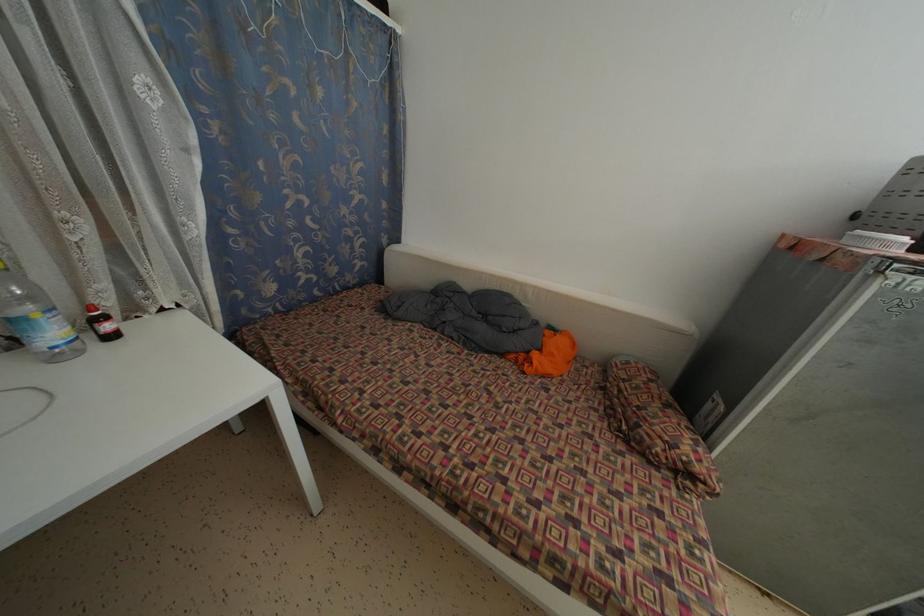
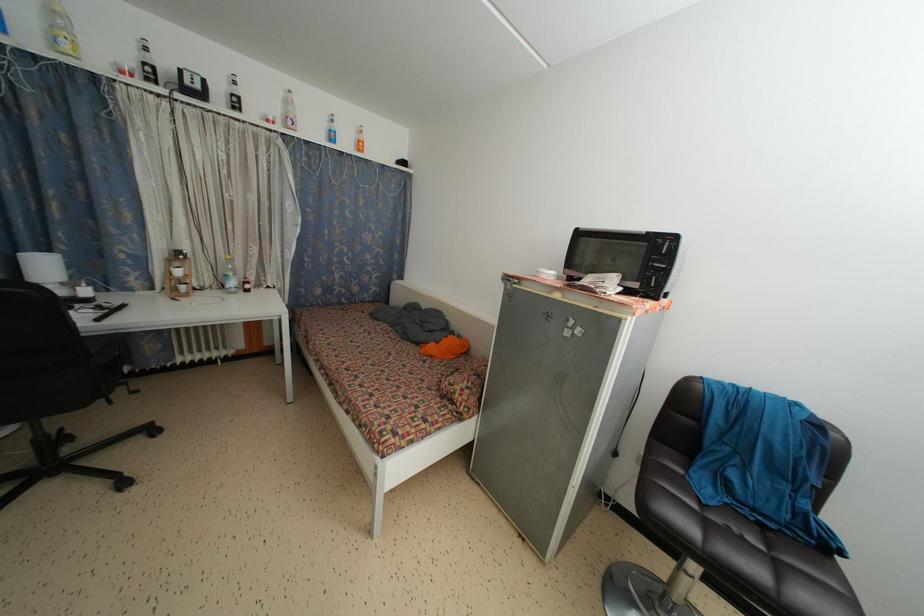
Where in the second image is the point corresponding to (57,339) from the first image?

(237, 289)